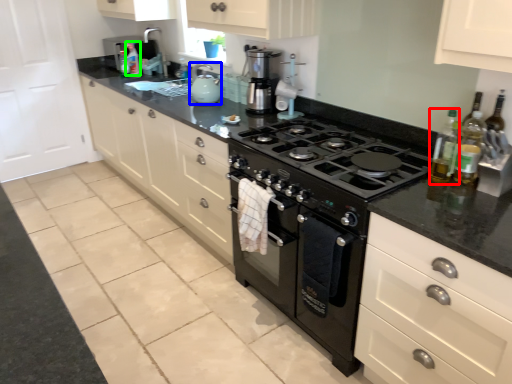
Question: Which is nearer to the bottle (highlighted by a red box)? kitchen appliance (highlighted by a blue box) or bottle (highlighted by a green box).

Choices:
 (A) kitchen appliance
 (B) bottle

Answer: (A)